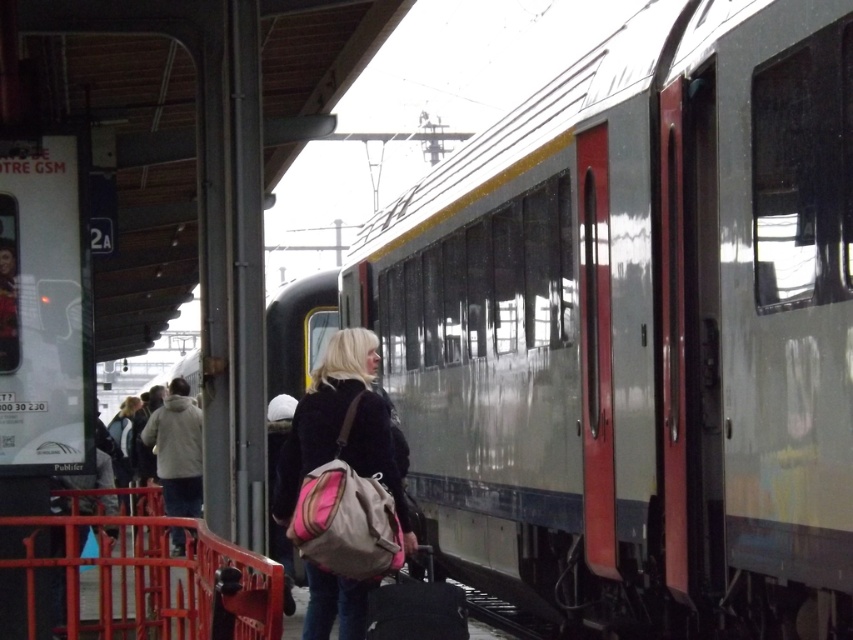
Question: Which object appears closest to the camera in this image?

Choices:
 (A) metallic silver train at center
 (B) matte black coat at center
 (C) light gray fleece jacket at left

Answer: (A)

Question: Which of the following is the farthest from the observer?

Choices:
 (A) light gray fleece jacket at left
 (B) metallic silver train at center
 (C) matte black coat at center

Answer: (A)

Question: Is metallic silver train at center above light gray fleece jacket at left?

Choices:
 (A) yes
 (B) no

Answer: (A)

Question: Which object appears farthest from the camera in this image?

Choices:
 (A) light gray fleece jacket at left
 (B) matte black coat at center
 (C) metallic silver train at center

Answer: (A)

Question: Can you confirm if metallic silver train at center is positioned to the right of light gray fleece jacket at left?

Choices:
 (A) yes
 (B) no

Answer: (A)

Question: Can you confirm if metallic silver train at center is positioned below matte black coat at center?

Choices:
 (A) no
 (B) yes

Answer: (B)